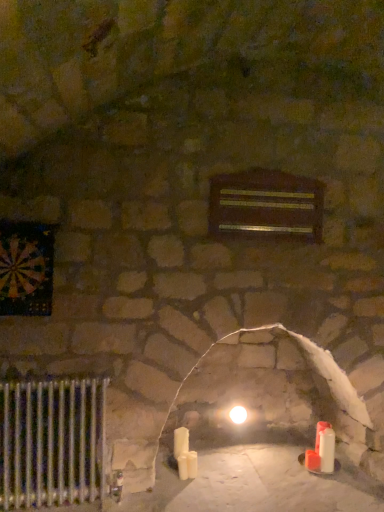
At what (x,y) coordinates should I click in order to perform the action: click on white glossy light bulb at center. Please return your answer as a coordinate pair (x, y). Looking at the image, I should click on (238, 414).

Describe the element at coordinates (238, 414) in the screenshot. I see `white glossy light bulb at center` at that location.

The height and width of the screenshot is (512, 384). Find the location of `silver metallic radiator at lower left`. silver metallic radiator at lower left is located at coordinates (52, 442).

Image resolution: width=384 pixels, height=512 pixels. What do you see at coordinates (319, 433) in the screenshot?
I see `white matte candle at lower right, the first candle in the right-to-left sequence` at bounding box center [319, 433].

Where is `white matte candle at center, which is counted as the 2th candle, starting from the left`? The image size is (384, 512). white matte candle at center, which is counted as the 2th candle, starting from the left is located at coordinates (192, 464).

Measure the distance between point (315, 217) and camera.

They are 2.65 meters apart.

What do you see at coordinates (266, 205) in the screenshot? The width and height of the screenshot is (384, 512). I see `wooden plaque at center` at bounding box center [266, 205].

You are a GUI agent. You are given a task and a screenshot of the screen. Output one action in this format:
    pyautogui.click(x=<x>, y=<y>)
    Task: Click on the white glossy light bulb at center
    
    Given the screenshot: What is the action you would take?
    pyautogui.click(x=238, y=414)

Where is `candle on the right side of white matte candle at center, which is the second candle from right to left`? This screenshot has width=384, height=512. candle on the right side of white matte candle at center, which is the second candle from right to left is located at coordinates (319, 433).

Does white matte candle at center, which is counted as the 2th candle, starting from the left, touch white matte candle at lower right, the first candle in the right-to-left sequence?

They are not placed beside each other.

Is point (195, 468) positioned in front of point (325, 424)?

Yes, it is in front of point (325, 424).

Which is in front, white matte candle at center, which is counted as the 2th candle, starting from the left, or white matte candle at lower right, the 3th candle in the left-to-right sequence?

white matte candle at center, which is counted as the 2th candle, starting from the left, is closer to the camera.

What's the angular difference between white matte candle at lower right, the first candle in the right-to-left sequence, and wooden plaque at center's facing directions?

There is a 2.26-degree angle between the facing directions of white matte candle at lower right, the first candle in the right-to-left sequence, and wooden plaque at center.

Does white matte candle at lower right, the 3th candle in the left-to-right sequence, have a greater height compared to wooden plaque at center?

No, white matte candle at lower right, the 3th candle in the left-to-right sequence, is not taller than wooden plaque at center.

Which is in front, white matte candle at lower right, the 3th candle in the left-to-right sequence, or wooden plaque at center?

wooden plaque at center is closer to the camera.

Is white matte candle at lower right, the first candle in the right-to-left sequence, not close to wooden plaque at center?

Yes, white matte candle at lower right, the first candle in the right-to-left sequence, is far from wooden plaque at center.

From the picture: From a real-world perspective, is white wax candle at center, which is the 1th candle from left to right, physically below wooden plaque at center?

Yes, from a real-world perspective, white wax candle at center, which is the 1th candle from left to right, is beneath wooden plaque at center.

Where is `candle that is the 2nd one when counting leftward from the wooden plaque at center`? The width and height of the screenshot is (384, 512). candle that is the 2nd one when counting leftward from the wooden plaque at center is located at coordinates pyautogui.click(x=181, y=441).

From the image's perspective, which object appears higher, white wax candle at center, which is the 1th candle from left to right, or wooden plaque at center?

wooden plaque at center is shown above in the image.

Can you confirm if white wax candle at center, marked as the 3th candle in a right-to-left arrangement, is taller than wooden plaque at center?

No, white wax candle at center, marked as the 3th candle in a right-to-left arrangement, is not taller than wooden plaque at center.

This screenshot has width=384, height=512. In order to click on candle that is the 2nd one when counting backward from the silver metallic radiator at lower left in this screenshot , I will do `click(181, 441)`.

Who is bigger, silver metallic radiator at lower left or white wax candle at center, marked as the 3th candle in a right-to-left arrangement?

silver metallic radiator at lower left.

Is silver metallic radiator at lower left oriented away from white wax candle at center, marked as the 3th candle in a right-to-left arrangement?

That's not correct — silver metallic radiator at lower left is not looking away from white wax candle at center, marked as the 3th candle in a right-to-left arrangement.

From the image's perspective, who appears lower, silver metallic radiator at lower left or white wax candle at center, which is the 1th candle from left to right?

white wax candle at center, which is the 1th candle from left to right, appears lower in the image.

Which is behind, white matte candle at lower right, the first candle in the right-to-left sequence, or silver metallic radiator at lower left?

Positioned behind is white matte candle at lower right, the first candle in the right-to-left sequence.

Is white matte candle at lower right, the 3th candle in the left-to-right sequence, oriented towards silver metallic radiator at lower left?

No, white matte candle at lower right, the 3th candle in the left-to-right sequence, does not turn towards silver metallic radiator at lower left.

Is white matte candle at lower right, the first candle in the right-to-left sequence, to the right of silver metallic radiator at lower left from the viewer's perspective?

Correct, you'll find white matte candle at lower right, the first candle in the right-to-left sequence, to the right of silver metallic radiator at lower left.

Could you measure the distance between white matte candle at lower right, the first candle in the right-to-left sequence, and silver metallic radiator at lower left?

white matte candle at lower right, the first candle in the right-to-left sequence, and silver metallic radiator at lower left are 5.47 feet apart from each other.

Is white matte candle at center, which is counted as the 2th candle, starting from the left, far away from wooden plaque at center?

Yes, white matte candle at center, which is counted as the 2th candle, starting from the left, is far from wooden plaque at center.

Does white matte candle at center, which is counted as the 2th candle, starting from the left, turn towards wooden plaque at center?

No, white matte candle at center, which is counted as the 2th candle, starting from the left, is not facing towards wooden plaque at center.

Considering the positions of objects white matte candle at center, which is counted as the 2th candle, starting from the left, and wooden plaque at center in the image provided, who is in front, white matte candle at center, which is counted as the 2th candle, starting from the left, or wooden plaque at center?

wooden plaque at center.

Is white matte candle at center, which is counted as the 2th candle, starting from the left, bigger than wooden plaque at center?

No.

Is white glossy light bulb at center shorter than silver metallic radiator at lower left?

Yes, white glossy light bulb at center is shorter than silver metallic radiator at lower left.

Does point (241, 406) come in front of point (69, 501)?

No, it is not.

Is white glossy light bulb at center closer to the viewer compared to silver metallic radiator at lower left?

That is False.

Could you tell me if white glossy light bulb at center is facing silver metallic radiator at lower left?

No.

Where is `the 2nd candle behind the white matte candle at center, which is the second candle from right to left, counting from the anchor's position`? The width and height of the screenshot is (384, 512). the 2nd candle behind the white matte candle at center, which is the second candle from right to left, counting from the anchor's position is located at coordinates (319, 433).

This screenshot has width=384, height=512. What are the coordinates of `candle on the right of the wooden plaque at center` in the screenshot? It's located at (319, 433).

Estimate the real-world distances between objects in this image. Which object is closer to white matte candle at lower right, the first candle in the right-to-left sequence, white glossy light bulb at center or silver metallic radiator at lower left?

Among the two, white glossy light bulb at center is located nearer to white matte candle at lower right, the first candle in the right-to-left sequence.

Estimate the real-world distances between objects in this image. Which object is further from white glossy light bulb at center, white matte candle at lower right, the 3th candle in the left-to-right sequence, or white matte candle at center, which is counted as the 2th candle, starting from the left?

white matte candle at lower right, the 3th candle in the left-to-right sequence.

Considering their positions, is white glossy light bulb at center positioned further to white wax candle at center, marked as the 3th candle in a right-to-left arrangement, than white matte candle at lower right, the 3th candle in the left-to-right sequence?

Based on the image, white matte candle at lower right, the 3th candle in the left-to-right sequence, appears to be further to white wax candle at center, marked as the 3th candle in a right-to-left arrangement.

When comparing their distances from silver metallic radiator at lower left, does white matte candle at lower right, the first candle in the right-to-left sequence, or white glossy light bulb at center seem further?

white matte candle at lower right, the first candle in the right-to-left sequence.

Which object lies nearer to the anchor point white wax candle at center, which is the 1th candle from left to right, silver metallic radiator at lower left or white matte candle at center, which is the second candle from right to left?

Among the two, white matte candle at center, which is the second candle from right to left, is located nearer to white wax candle at center, which is the 1th candle from left to right.

Looking at the image, which one is located closer to wooden plaque at center, white matte candle at lower right, the 3th candle in the left-to-right sequence, or white matte candle at center, which is the second candle from right to left?

white matte candle at lower right, the 3th candle in the left-to-right sequence.

Considering their positions, is white matte candle at center, which is counted as the 2th candle, starting from the left, positioned closer to white glossy light bulb at center than silver metallic radiator at lower left?

white matte candle at center, which is counted as the 2th candle, starting from the left, is positioned closer to the anchor white glossy light bulb at center.

Which object lies further to the anchor point white matte candle at lower right, the first candle in the right-to-left sequence, silver metallic radiator at lower left or white matte candle at center, which is counted as the 2th candle, starting from the left?

silver metallic radiator at lower left is further to white matte candle at lower right, the first candle in the right-to-left sequence.

Locate an element on the screen. glow situated between white wax candle at center, which is the 1th candle from left to right, and white matte candle at lower right, the 3th candle in the left-to-right sequence, from left to right is located at coordinates (238, 414).

The height and width of the screenshot is (512, 384). Identify the location of glow between wooden plaque at center and white wax candle at center, which is the 1th candle from left to right, vertically. tap(238, 414).

You are a GUI agent. You are given a task and a screenshot of the screen. Output one action in this format:
    pyautogui.click(x=<x>, y=<y>)
    Task: Click on the radiator that lies between wooden plaque at center and white glossy light bulb at center from top to bottom
    
    Given the screenshot: What is the action you would take?
    pyautogui.click(x=52, y=442)

This screenshot has height=512, width=384. What are the coordinates of `candle situated between silver metallic radiator at lower left and white matte candle at center, which is counted as the 2th candle, starting from the left, from left to right` in the screenshot? It's located at (181, 441).